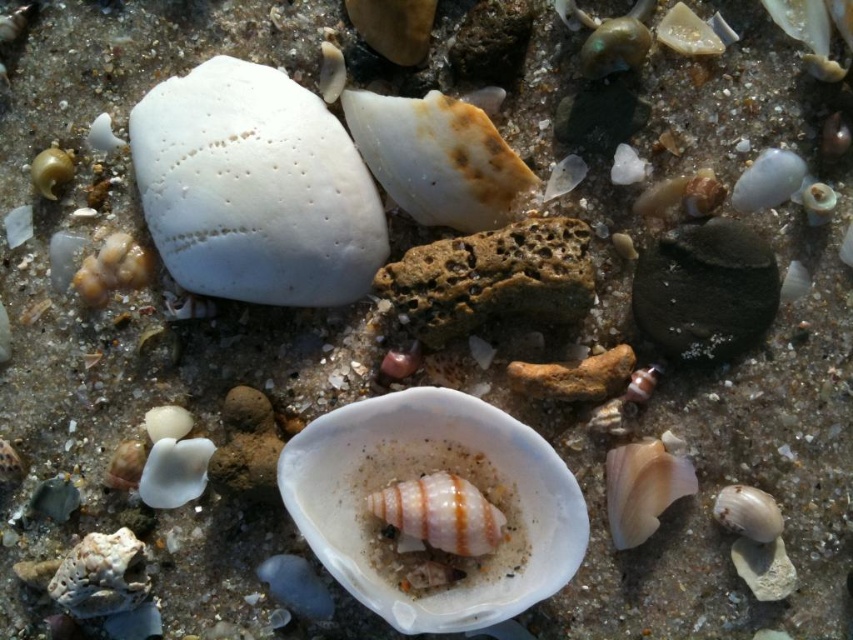
Describe the element at coordinates (254, 188) in the screenshot. I see `white matte shell at upper left` at that location.

Is white matte shell at upper left shorter than pink glossy snail at center?

No.

I want to click on white matte shell at upper left, so click(x=254, y=188).

Who is more forward, (315,474) or (386,506)?

Point (386,506) is more forward.

Is point (357, 552) positioned in front of point (451, 508)?

That is False.

Which is behind, point (463, 440) or point (421, 540)?

Point (463, 440)

You are a GUI agent. You are given a task and a screenshot of the screen. Output one action in this format:
    pyautogui.click(x=<x>, y=<y>)
    Task: Click on the white glossy shell at center
    
    Given the screenshot: What is the action you would take?
    pyautogui.click(x=421, y=477)

Who is lower down, white matte shell at upper left or white glossy shell at center?

white glossy shell at center is lower down.

You are a GUI agent. You are given a task and a screenshot of the screen. Output one action in this format:
    pyautogui.click(x=<x>, y=<y>)
    Task: Click on the white matte shell at upper left
    Image resolution: width=853 pixels, height=640 pixels.
    Given the screenshot: What is the action you would take?
    pyautogui.click(x=254, y=188)

Describe the element at coordinates (254, 188) in the screenshot. I see `white matte shell at upper left` at that location.

This screenshot has width=853, height=640. In order to click on white matte shell at upper left in this screenshot , I will do `click(254, 188)`.